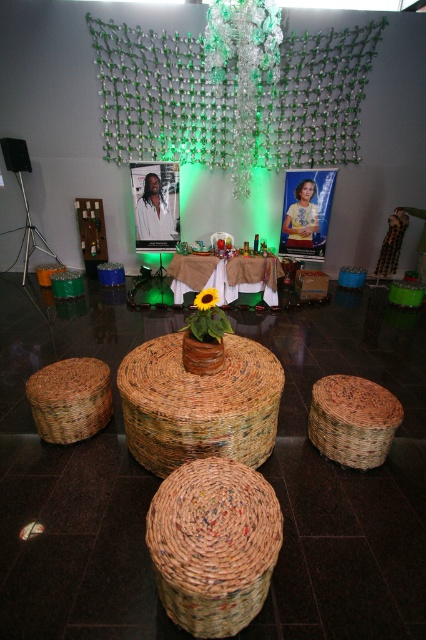
Is point (40, 424) in front of point (226, 317)?

No, (40, 424) is further to viewer.

In the scene shown: Is brown woven basket at lower left to the left of yellow matte sunflower pot at center from the viewer's perspective?

Indeed, brown woven basket at lower left is positioned on the left side of yellow matte sunflower pot at center.

Does point (88, 364) come behind point (199, 294)?

Yes, point (88, 364) is behind point (199, 294).

I want to click on brown woven basket at lower left, so click(71, 397).

Does woven straw basket at lower right have a smaller size compared to brown woven basket at lower left?

Correct, woven straw basket at lower right occupies less space than brown woven basket at lower left.

Is woven straw basket at lower right to the right of brown woven basket at lower left from the viewer's perspective?

Correct, you'll find woven straw basket at lower right to the right of brown woven basket at lower left.

Measure the distance between point (368, 404) and camera.

8.67 feet

You are a GUI agent. You are given a task and a screenshot of the screen. Output one action in this format:
    pyautogui.click(x=<x>, y=<y>)
    Task: Click on the woven straw basket at lower right
    Image resolution: width=426 pixels, height=640 pixels.
    Given the screenshot: What is the action you would take?
    pyautogui.click(x=353, y=419)

In the scene shown: Does brown woven basket at center have a smaller size compared to yellow matte sunflower at center?

Incorrect, brown woven basket at center is not smaller in size than yellow matte sunflower at center.

Is brown woven basket at center to the right of yellow matte sunflower at center from the viewer's perspective?

Yes, brown woven basket at center is to the right of yellow matte sunflower at center.

Which is behind, point (230, 568) or point (198, 301)?

The point (198, 301) is more distant.

Locate an element on the screen. This screenshot has width=426, height=640. brown woven basket at center is located at coordinates (213, 545).